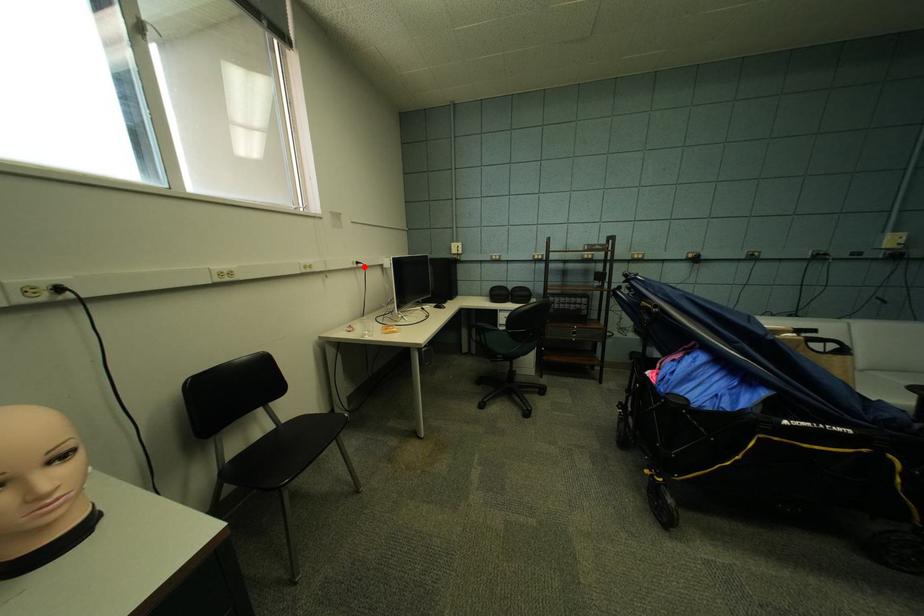
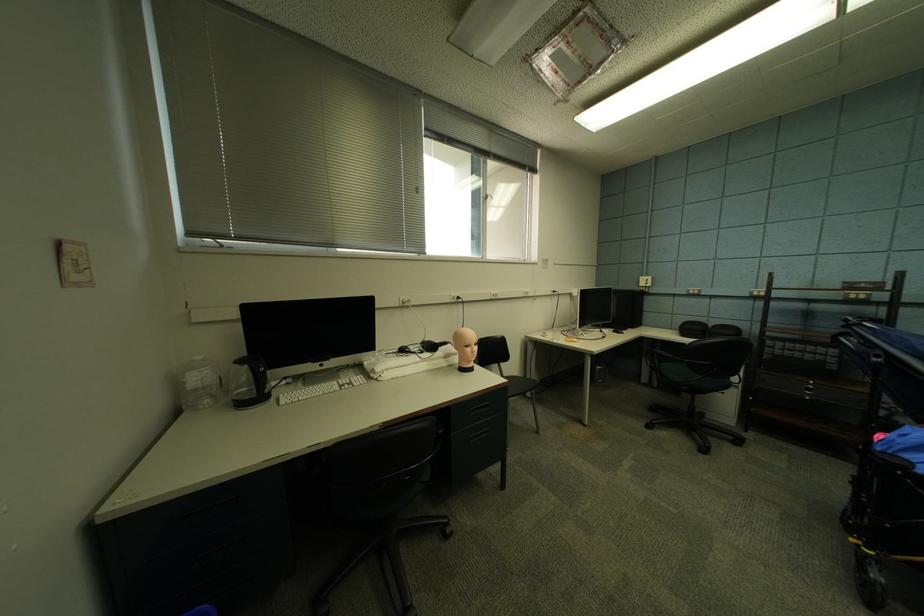
In the second image, find the point that corresponds to the highlighted location in the first image.

(561, 294)